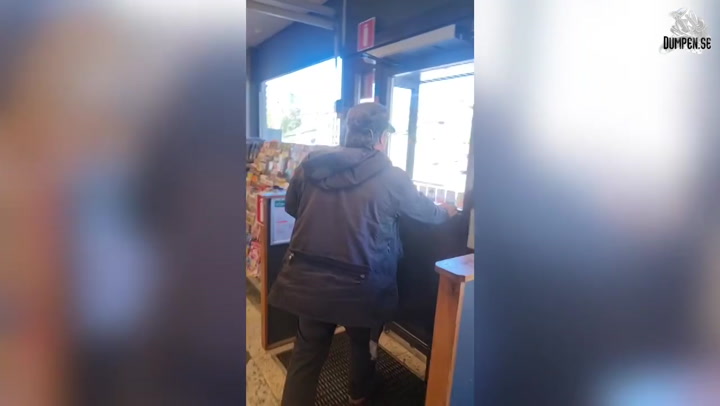
Identify the location of walls. click(274, 50), click(402, 18).